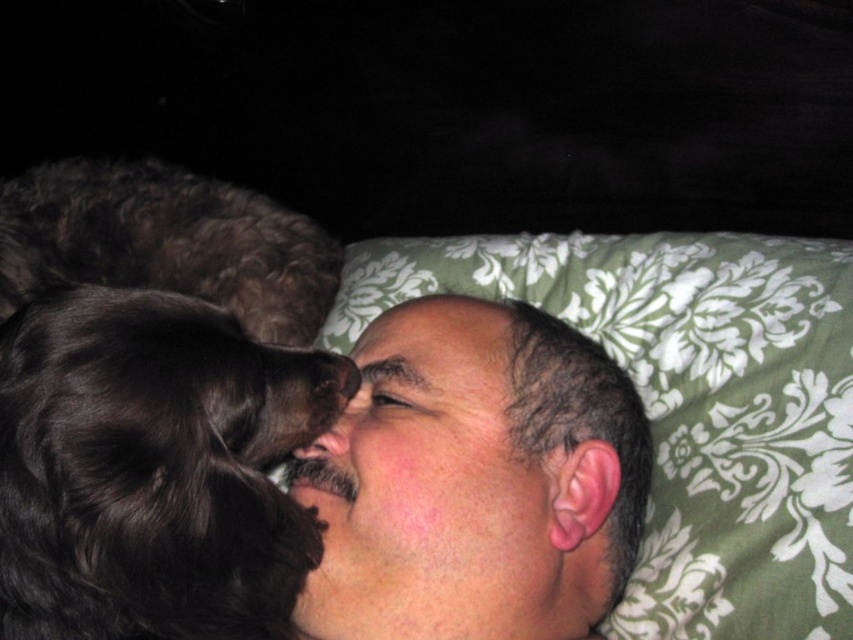
You are a photographer setting up a shot. You have a camera that can focus on objects within 50 cm. You see the green floral fabric at center in the scene. Can your camera focus on it?

The distance of green floral fabric at center from camera is 60.91 centimeters, which is beyond the camera focus range of 50 cm. The camera cannot focus on it.

You are a photographer trying to capture a closeup of the man and his dog in the image. The camera is positioned at point (x=732, y=368). You want to adjust the camera to focus on the man and dog without moving them. What should you do?

The camera is 33.46 inches away from the point (x=732, y=368). To focus on the man and dog, you can adjust the camera lens to a focal length that allows capturing the subject at this distance while maintaining clarity and composition.

You are a photographer trying to capture a closeup of the man and his dog in the image. The focus point is set at point (366, 364) which is 30.50 inches from the camera. If your camera has a depth of field that can sharply focus objects within 28 to 33 inches from the lens, will the man and dog be in focus?

The focus point at point (366, 364) is 30.50 inches from the camera. Since the depth of field ranges from 28 to 33 inches, the man and dog at this distance will be within the sharp focus range and therefore in focus.